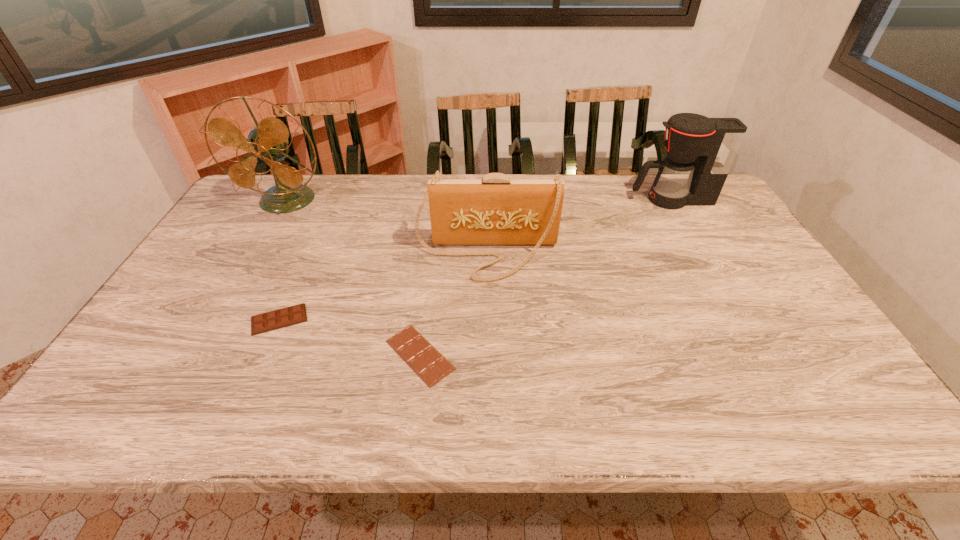
Identify the location of vacant region located 0.310m pour from the carafe of the rightmost object. (540, 199).

The height and width of the screenshot is (540, 960). In order to click on free point located 0.320m pour from the carafe of the rightmost object in this screenshot , I will do `click(537, 199)`.

Locate an element on the screen. This screenshot has height=540, width=960. free space located 0.380m pour from the carafe of the rightmost object is located at coordinates (519, 199).

Where is `vacant region located on the decorative side of the third nearest object`? The image size is (960, 540). vacant region located on the decorative side of the third nearest object is located at coordinates (488, 341).

You are a GUI agent. You are given a task and a screenshot of the screen. Output one action in this format:
    pyautogui.click(x=<x>, y=<y>)
    Task: Click on the blank space located on the back of the left chocolate bar
    The width and height of the screenshot is (960, 540).
    Given the screenshot: What is the action you would take?
    pyautogui.click(x=302, y=268)

Where is `vacant region located 0.260m on the left of the shorter chocolate bar`? The height and width of the screenshot is (540, 960). vacant region located 0.260m on the left of the shorter chocolate bar is located at coordinates (272, 355).

Find the location of a particular element. fan located at the far edge is located at coordinates (268, 140).

I want to click on coffee maker that is at the far edge, so click(x=700, y=151).

Image resolution: width=960 pixels, height=540 pixels. Find the location of `object at the near edge`. object at the near edge is located at coordinates (431, 366).

Where is `object that is at the left edge`? Image resolution: width=960 pixels, height=540 pixels. object that is at the left edge is located at coordinates coord(268,140).